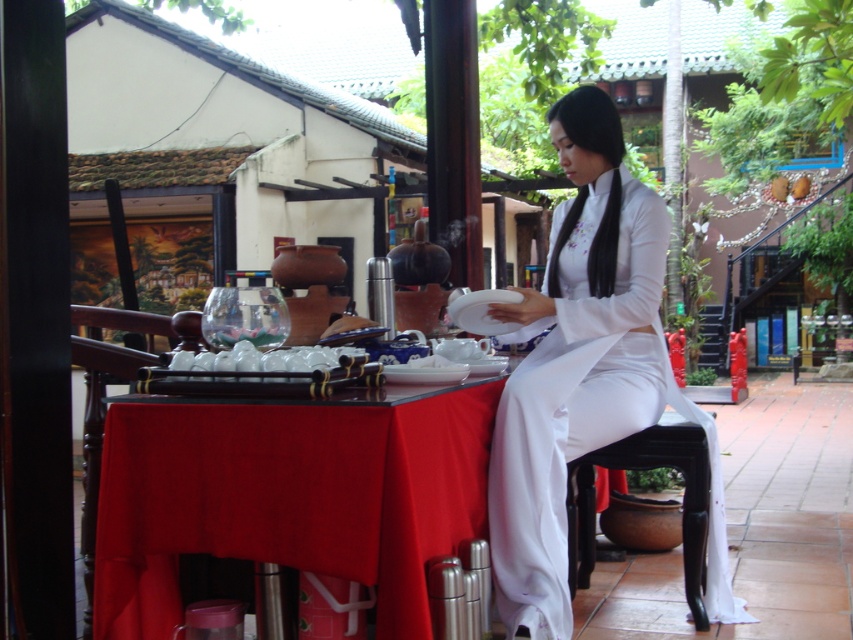
Does smooth red cloth at center appear on the right side of black wood stool at lower right?

In fact, smooth red cloth at center is to the left of black wood stool at lower right.

Does smooth red cloth at center have a greater width compared to black wood stool at lower right?

Yes, smooth red cloth at center is wider than black wood stool at lower right.

Where is `smooth red cloth at center`? The height and width of the screenshot is (640, 853). smooth red cloth at center is located at coordinates (288, 497).

Identify the location of smooth red cloth at center. The height and width of the screenshot is (640, 853). (288, 497).

Which is more to the right, smooth red cloth at center or white silk ao dai at center?

From the viewer's perspective, white silk ao dai at center appears more on the right side.

Which is in front, point (248, 477) or point (553, 349)?

Positioned in front is point (248, 477).

Where is `smooth red cloth at center`? This screenshot has width=853, height=640. smooth red cloth at center is located at coordinates (288, 497).

You are a GUI agent. You are given a task and a screenshot of the screen. Output one action in this format:
    pyautogui.click(x=<x>, y=<y>)
    Task: Click on the smooth red cloth at center
    
    Given the screenshot: What is the action you would take?
    pyautogui.click(x=288, y=497)

Is point (566, 420) positioned after point (677, 429)?

No, (566, 420) is closer to viewer.

Is point (601, 406) in front of point (631, 465)?

Yes, point (601, 406) is in front of point (631, 465).

This screenshot has height=640, width=853. Find the location of `white silk ao dai at center`. white silk ao dai at center is located at coordinates (573, 360).